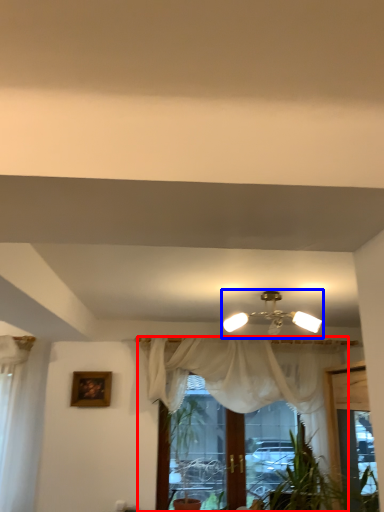
Question: Which of the following is the farthest to the observer, curtain (highlighted by a red box) or lamp (highlighted by a blue box)?

Choices:
 (A) curtain
 (B) lamp

Answer: (A)